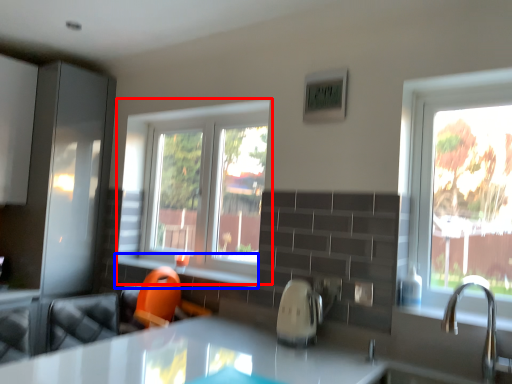
Question: Which of the following is the closest to the observer, window (highlighted by a red box) or window sill (highlighted by a blue box)?

Choices:
 (A) window
 (B) window sill

Answer: (B)